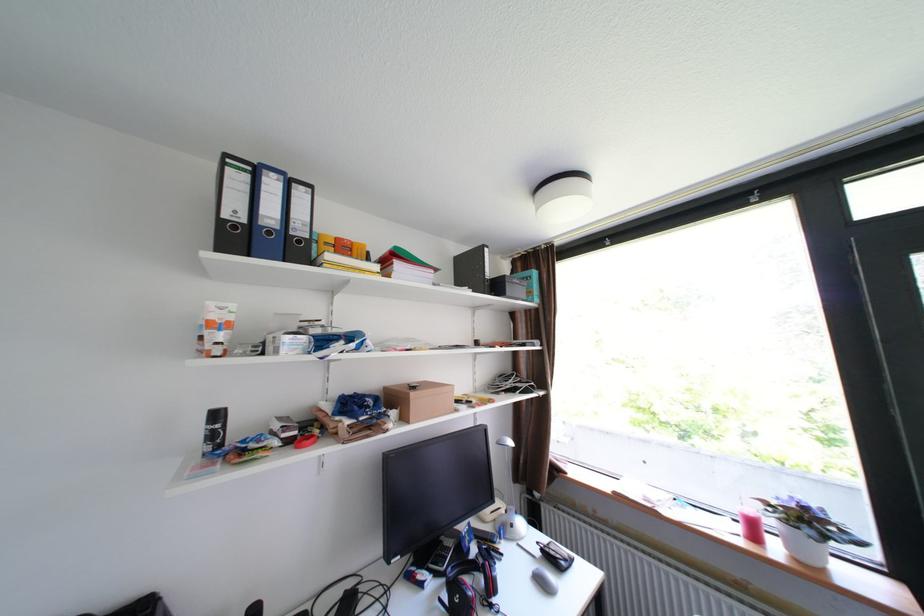
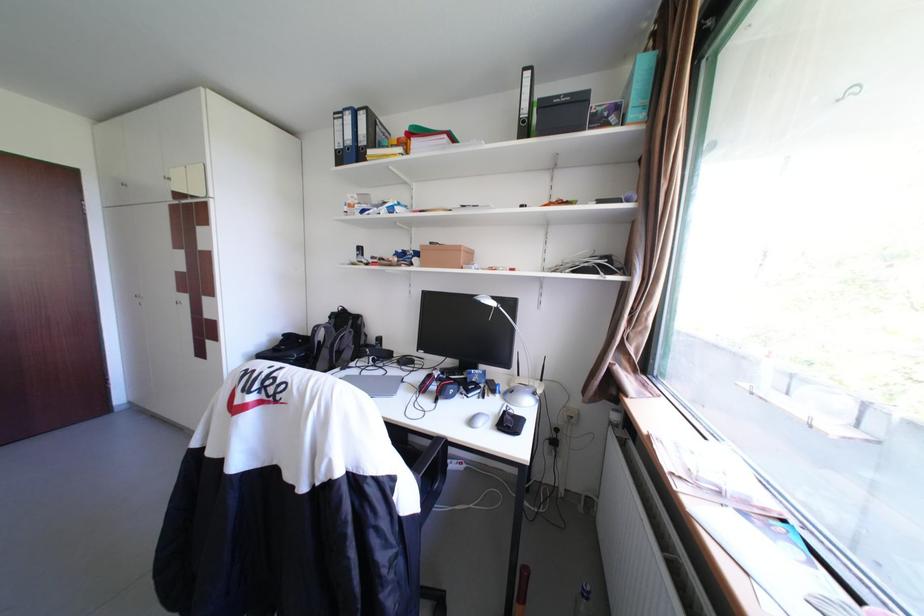
Find the pixel in the second image that matches (249,238) in the first image.

(351, 158)